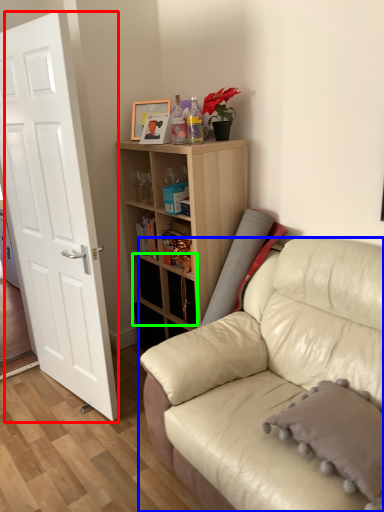
Question: Which object is the farthest from door (highlighted by a red box)? Choose among these: studio couch (highlighted by a blue box) or drawer (highlighted by a green box).

Choices:
 (A) studio couch
 (B) drawer

Answer: (A)